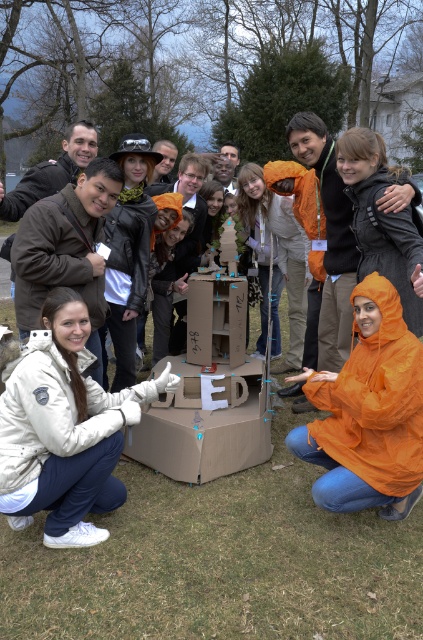
Between point (80, 506) and point (420, 372), which one is positioned in front?

Positioned in front is point (80, 506).

Between point (11, 483) and point (307, 429), which one is positioned in front?

Point (11, 483) is in front.

Where is `white fleece jacket at lower left`? white fleece jacket at lower left is located at coordinates (63, 428).

Does white fleece jacket at lower left have a smaller size compared to cardboard box at center?

No, white fleece jacket at lower left is not smaller than cardboard box at center.

Does white fleece jacket at lower left appear on the left side of cardboard box at center?

Indeed, white fleece jacket at lower left is positioned on the left side of cardboard box at center.

Does point (112, 484) come behind point (263, 426)?

No, (112, 484) is closer to viewer.

Locate an element on the screen. Image resolution: width=423 pixels, height=640 pixels. white fleece jacket at lower left is located at coordinates (63, 428).

Which of these two, orange waterproof jacket at lower center or cardboard box at center, stands taller?

orange waterproof jacket at lower center is taller.

Which is more to the left, orange waterproof jacket at lower center or cardboard box at center?

Positioned to the left is cardboard box at center.

At what (x,y) coordinates should I click in order to perform the action: click on orange waterproof jacket at lower center. Please return your answer as a coordinate pair (x, y). Looking at the image, I should click on (368, 412).